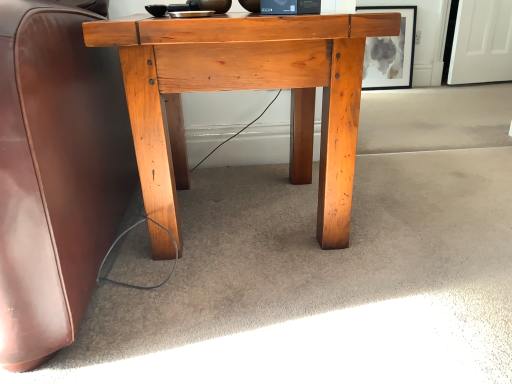
What do you see at coordinates (246, 89) in the screenshot?
I see `natural wood desk at center` at bounding box center [246, 89].

At what (x,y) coordinates should I click in order to perform the action: click on natural wood desk at center. Please return your answer as a coordinate pair (x, y). The width and height of the screenshot is (512, 384). Looking at the image, I should click on (246, 89).

What is the approximate width of matte black picture frame at upper center?

The width of matte black picture frame at upper center is 4.14 inches.

The image size is (512, 384). I want to click on matte black picture frame at upper center, so click(390, 52).

Measure the distance between matte black picture frame at upper center and camera.

They are 2.59 meters apart.

Describe the element at coordinates (390, 52) in the screenshot. The image size is (512, 384). I see `matte black picture frame at upper center` at that location.

Image resolution: width=512 pixels, height=384 pixels. In order to click on natural wood desk at center in this screenshot , I will do `click(246, 89)`.

Is natural wood desk at center to the left of matte black picture frame at upper center from the viewer's perspective?

Correct, you'll find natural wood desk at center to the left of matte black picture frame at upper center.

Is natural wood desk at center in front of or behind matte black picture frame at upper center in the image?

Visually, natural wood desk at center is located in front of matte black picture frame at upper center.

Considering the positions of points (333, 180) and (411, 29), is point (333, 180) closer to camera compared to point (411, 29)?

Yes, point (333, 180) is in front of point (411, 29).

From the image's perspective, who appears lower, natural wood desk at center or matte black picture frame at upper center?

natural wood desk at center, from the image's perspective.

From a real-world perspective, is natural wood desk at center positioned under matte black picture frame at upper center based on gravity?

No.

Considering the relative sizes of natural wood desk at center and matte black picture frame at upper center in the image provided, is natural wood desk at center wider than matte black picture frame at upper center?

Correct, the width of natural wood desk at center exceeds that of matte black picture frame at upper center.

Based on the photo, in terms of height, does natural wood desk at center look taller or shorter compared to matte black picture frame at upper center?

Clearly, natural wood desk at center is taller compared to matte black picture frame at upper center.

Considering the sizes of objects natural wood desk at center and matte black picture frame at upper center in the image provided, who is bigger, natural wood desk at center or matte black picture frame at upper center?

natural wood desk at center.

Which is correct: natural wood desk at center is inside matte black picture frame at upper center, or outside of it?

natural wood desk at center is not enclosed by matte black picture frame at upper center.

Is there a large distance between natural wood desk at center and matte black picture frame at upper center?

Yes, natural wood desk at center and matte black picture frame at upper center are quite far apart.

Is matte black picture frame at upper center at the back of natural wood desk at center?

No, natural wood desk at center's orientation is not away from matte black picture frame at upper center.

In order to click on picture frame that appears below the natural wood desk at center (from a real-world perspective) in this screenshot , I will do `click(390, 52)`.

Based on their positions, is matte black picture frame at upper center located to the left or right of natural wood desk at center?

Based on their positions, matte black picture frame at upper center is located to the right of natural wood desk at center.

Which is in front, matte black picture frame at upper center or natural wood desk at center?

natural wood desk at center is closer to the camera.

Is point (399, 47) in front of point (341, 63)?

That is False.

From the image's perspective, which object appears higher, matte black picture frame at upper center or natural wood desk at center?

matte black picture frame at upper center appears higher in the image.

From a real-world perspective, is matte black picture frame at upper center located beneath natural wood desk at center?

Yes.

Considering the sizes of matte black picture frame at upper center and natural wood desk at center in the image, is matte black picture frame at upper center wider or thinner than natural wood desk at center?

matte black picture frame at upper center is thinner than natural wood desk at center.

Considering the relative sizes of matte black picture frame at upper center and natural wood desk at center in the image provided, is matte black picture frame at upper center shorter than natural wood desk at center?

Correct, matte black picture frame at upper center is not as tall as natural wood desk at center.

Considering the relative sizes of matte black picture frame at upper center and natural wood desk at center in the image provided, is matte black picture frame at upper center bigger than natural wood desk at center?

Incorrect, matte black picture frame at upper center is not larger than natural wood desk at center.

Looking at this image, can we say matte black picture frame at upper center lies outside natural wood desk at center?

Yes, matte black picture frame at upper center is not within natural wood desk at center.

Is matte black picture frame at upper center placed right next to natural wood desk at center?

No, matte black picture frame at upper center is not with natural wood desk at center.

Is matte black picture frame at upper center oriented away from natural wood desk at center?

No, matte black picture frame at upper center is not facing away from natural wood desk at center.

Can you tell me how much matte black picture frame at upper center and natural wood desk at center differ in facing direction?

0.347 degrees.

How distant is matte black picture frame at upper center from natural wood desk at center?

matte black picture frame at upper center and natural wood desk at center are 6.77 feet apart from each other.

Identify the location of desk on the left of matte black picture frame at upper center. The image size is (512, 384). (246, 89).

The image size is (512, 384). What are the coordinates of `desk above the matte black picture frame at upper center (from a real-world perspective)` in the screenshot? It's located at (246, 89).

Find the location of a particular element. picture frame above the natural wood desk at center (from the image's perspective) is located at coordinates (390, 52).